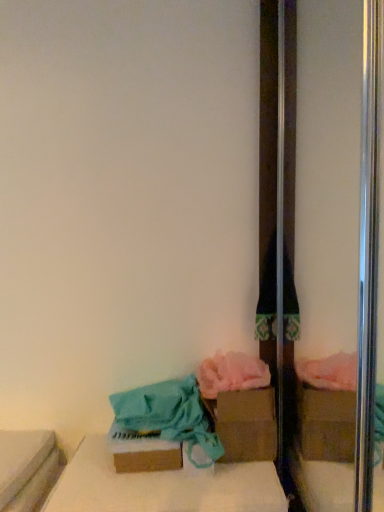
Question: From a real-world perspective, is pink fluffy towel at lower center, which is the 2th material from left to right, physically below brown cardboard box at lower center, the second cardboard box from the back?

Choices:
 (A) no
 (B) yes

Answer: (A)

Question: From the image's perspective, is pink fluffy towel at lower center, which is the 2th material from left to right, beneath brown cardboard box at lower center, which is the 1th cardboard box from left to right?

Choices:
 (A) no
 (B) yes

Answer: (A)

Question: Can brown cardboard box at lower center, which is the 1th cardboard box from left to right, be found inside pink fluffy towel at lower center, marked as the first material in a right-to-left arrangement?

Choices:
 (A) yes
 (B) no

Answer: (B)

Question: Can you confirm if pink fluffy towel at lower center, which is the 2th material from left to right, is shorter than brown cardboard box at lower center, which is the 1th cardboard box from left to right?

Choices:
 (A) no
 (B) yes

Answer: (B)

Question: Is pink fluffy towel at lower center, which is the 2th material from left to right, oriented towards brown cardboard box at lower center, which is the 1th cardboard box from left to right?

Choices:
 (A) yes
 (B) no

Answer: (B)

Question: Can you confirm if pink fluffy towel at lower center, marked as the first material in a right-to-left arrangement, is bigger than brown cardboard box at lower center, which is the second cardboard box from right to left?

Choices:
 (A) yes
 (B) no

Answer: (A)

Question: Can you confirm if brown cardboard box at lower center, which is the 1th cardboard box from left to right, is bigger than teal fabric bag at lower left, the first material in the left-to-right sequence?

Choices:
 (A) yes
 (B) no

Answer: (B)

Question: Is brown cardboard box at lower center, the first cardboard box positioned from the front, beside teal fabric bag at lower left, the 2th material in the right-to-left sequence?

Choices:
 (A) no
 (B) yes

Answer: (B)

Question: Is brown cardboard box at lower center, which is the second cardboard box from right to left, not close to teal fabric bag at lower left, the 2th material in the right-to-left sequence?

Choices:
 (A) yes
 (B) no

Answer: (B)

Question: Is teal fabric bag at lower left, the first material in the left-to-right sequence, located within brown cardboard box at lower center, the first cardboard box positioned from the front?

Choices:
 (A) no
 (B) yes

Answer: (A)

Question: From a real-world perspective, is brown cardboard box at lower center, which is the 1th cardboard box from left to right, located beneath teal fabric bag at lower left, the first material in the left-to-right sequence?

Choices:
 (A) no
 (B) yes

Answer: (B)

Question: From the image's perspective, would you say brown cardboard box at lower center, the second cardboard box from the back, is positioned over teal fabric bag at lower left, the 2th material in the right-to-left sequence?

Choices:
 (A) no
 (B) yes

Answer: (A)

Question: Is teal fabric bag at lower left, the 2th material in the right-to-left sequence, far from brown cardboard box at center, placed as the 1th cardboard box when sorted from back to front?

Choices:
 (A) no
 (B) yes

Answer: (A)